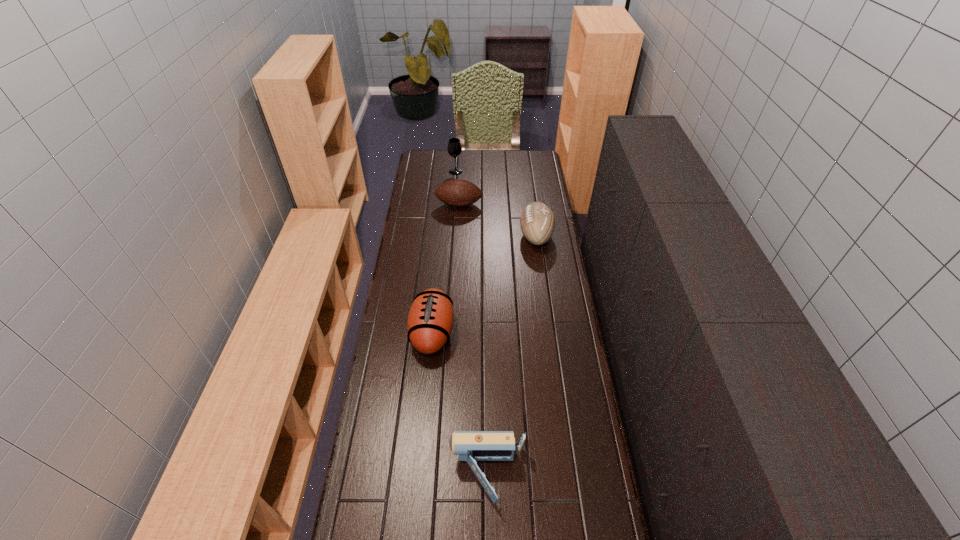
Where is `free location located on the laces of the rightmost object`? This screenshot has height=540, width=960. free location located on the laces of the rightmost object is located at coordinates [x=490, y=236].

Identify the location of vacant space located 0.370m on the laces of the rightmost object. click(x=443, y=236).

The height and width of the screenshot is (540, 960). In order to click on vacant space situated 0.140m on the laces of the farthest football in this screenshot , I will do `click(458, 231)`.

The image size is (960, 540). I want to click on free spot located on the side of the nearest object with the flip-out screen, so click(x=385, y=475).

Identify the location of free spot located on the side of the nearest object with the flip-out screen. Image resolution: width=960 pixels, height=540 pixels. (372, 475).

Locate an element on the screen. The width and height of the screenshot is (960, 540). vacant region located 0.140m on the side of the nearest object with the flip-out screen is located at coordinates (404, 475).

At what (x,y) coordinates should I click in order to perform the action: click on object present at the far edge. Please return your answer as a coordinate pair (x, y). The width and height of the screenshot is (960, 540). Looking at the image, I should click on point(454,148).

Identify the location of object that is at the right edge. This screenshot has height=540, width=960. (537, 222).

Find the location of a particular element. This screenshot has height=540, width=960. free space at the left edge of the desktop is located at coordinates (404, 415).

In the image, there is a desktop. Where is `vacant space at the right edge`? The width and height of the screenshot is (960, 540). vacant space at the right edge is located at coordinates (570, 480).